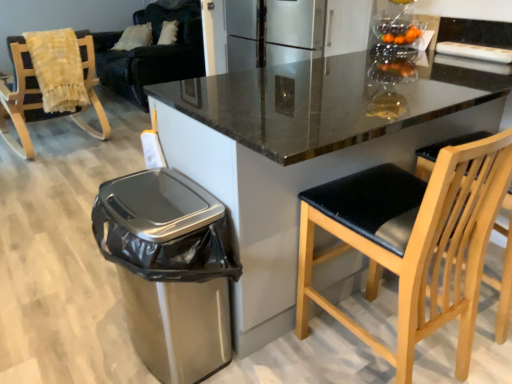
The height and width of the screenshot is (384, 512). Describe the element at coordinates (412, 241) in the screenshot. I see `black leather chair at right, positioned as the first chair in right-to-left order` at that location.

The width and height of the screenshot is (512, 384). What do you see at coordinates (152, 53) in the screenshot?
I see `dark blue fabric couch at upper left` at bounding box center [152, 53].

The width and height of the screenshot is (512, 384). What do you see at coordinates (302, 153) in the screenshot? I see `granite countertop at center` at bounding box center [302, 153].

In order to face wooden rocking chair with fringed blanket at left, the first chair from the back, should I rotate leftwards or rightwards?

A 26.416 degree turn to the left will do.

Consider the image. In order to face satin silver trash can at lower left, should I rotate leftwards or rightwards?

To align with it, rotate left about 12.790°.

Where is `black leather chair at right, positioned as the first chair in right-to-left order`? This screenshot has width=512, height=384. black leather chair at right, positioned as the first chair in right-to-left order is located at coordinates (412, 241).

Do you think satin silver trash can at lower left is within dark blue fabric couch at upper left, or outside of it?

satin silver trash can at lower left is not inside dark blue fabric couch at upper left, it's outside.

Between satin silver trash can at lower left and dark blue fabric couch at upper left, which one has larger width?

With larger width is dark blue fabric couch at upper left.

Considering the relative positions of satin silver trash can at lower left and dark blue fabric couch at upper left in the image provided, is satin silver trash can at lower left to the left or to the right of dark blue fabric couch at upper left?

Clearly, satin silver trash can at lower left is on the right of dark blue fabric couch at upper left in the image.

Considering the positions of point (176, 17) and point (469, 177), is point (176, 17) closer or farther from the camera than point (469, 177)?

Point (176, 17).

From the image's perspective, is dark blue fabric couch at upper left positioned above or below black leather chair at right, the 1th chair when ordered from bottom to top?

dark blue fabric couch at upper left is above black leather chair at right, the 1th chair when ordered from bottom to top.

There is a black leather chair at right, the 1th chair when ordered from bottom to top. Where is `couch above it (from a real-world perspective)`? couch above it (from a real-world perspective) is located at coordinates (152, 53).

Who is more distant, dark blue fabric couch at upper left or black leather chair at right, which appears as the 1th chair when viewed from the front?

dark blue fabric couch at upper left.

Based on the photo, is the depth of granite countertop at center greater than that of wooden rocking chair with fringed blanket at left, the first chair from the back?

No, it is in front of wooden rocking chair with fringed blanket at left, the first chair from the back.

Which is in front, point (403, 157) or point (27, 109)?

Positioned in front is point (403, 157).

Considering the sizes of objects granite countertop at center and wooden rocking chair with fringed blanket at left, the 1th chair positioned from the left, in the image provided, who is smaller, granite countertop at center or wooden rocking chair with fringed blanket at left, the 1th chair positioned from the left,?

With smaller size is wooden rocking chair with fringed blanket at left, the 1th chair positioned from the left.

From a real-world perspective, is wooden rocking chair with fringed blanket at left, which is the 1th chair from top to bottom, positioned over dark blue fabric couch at upper left based on gravity?

No, from a real-world perspective, wooden rocking chair with fringed blanket at left, which is the 1th chair from top to bottom, is not over dark blue fabric couch at upper left

Is the position of wooden rocking chair with fringed blanket at left, the first chair from the back, less distant than that of dark blue fabric couch at upper left?

Yes, it is in front of dark blue fabric couch at upper left.

How much distance is there between wooden rocking chair with fringed blanket at left, which is the 2th chair from bottom to top, and dark blue fabric couch at upper left?

wooden rocking chair with fringed blanket at left, which is the 2th chair from bottom to top, and dark blue fabric couch at upper left are 1.08 meters apart from each other.

Considering the relative sizes of wooden rocking chair with fringed blanket at left, the 1th chair positioned from the left, and dark blue fabric couch at upper left in the image provided, is wooden rocking chair with fringed blanket at left, the 1th chair positioned from the left, bigger than dark blue fabric couch at upper left?

Actually, wooden rocking chair with fringed blanket at left, the 1th chair positioned from the left, might be smaller than dark blue fabric couch at upper left.

What's the angular difference between black leather chair at right, the 2th chair viewed from the top, and granite countertop at center's facing directions?

The angle between the facing direction of black leather chair at right, the 2th chair viewed from the top, and the facing direction of granite countertop at center is 2.89 degrees.

Find the location of a particular element. This screenshot has height=384, width=512. countertop above the black leather chair at right, the 2th chair viewed from the top (from the image's perspective) is located at coordinates tap(302, 153).

Based on the photo, is black leather chair at right, positioned as the first chair in right-to-left order, positioned behind granite countertop at center?

Yes, black leather chair at right, positioned as the first chair in right-to-left order, is further from the camera.

From a real-world perspective, is black leather chair at right, the 2th chair viewed from the top, on granite countertop at center?

Incorrect, from a real-world perspective, black leather chair at right, the 2th chair viewed from the top, is lower than granite countertop at center.

Who is taller, black leather chair at right, the second chair in the left-to-right sequence, or satin silver trash can at lower left?

With more height is black leather chair at right, the second chair in the left-to-right sequence.

Can you confirm if black leather chair at right, positioned as the first chair in right-to-left order, is positioned to the left of satin silver trash can at lower left?

Incorrect, black leather chair at right, positioned as the first chair in right-to-left order, is not on the left side of satin silver trash can at lower left.

From the image's perspective, which object appears higher, black leather chair at right, the 1th chair when ordered from bottom to top, or satin silver trash can at lower left?

From the image's view, black leather chair at right, the 1th chair when ordered from bottom to top, is above.

Is the position of black leather chair at right, the 1th chair when ordered from bottom to top, less distant than that of satin silver trash can at lower left?

Yes, black leather chair at right, the 1th chair when ordered from bottom to top, is in front of satin silver trash can at lower left.

Could you tell me if satin silver trash can at lower left is turned towards black leather chair at right, positioned as the first chair in right-to-left order?

No, satin silver trash can at lower left is not turned towards black leather chair at right, positioned as the first chair in right-to-left order.

Can you tell me how much satin silver trash can at lower left and black leather chair at right, the second chair in the left-to-right sequence, differ in facing direction?

There is a 92.9-degree angle between the facing directions of satin silver trash can at lower left and black leather chair at right, the second chair in the left-to-right sequence.

Is there a large distance between satin silver trash can at lower left and black leather chair at right, arranged as the second chair when viewed from the back?

satin silver trash can at lower left is actually quite close to black leather chair at right, arranged as the second chair when viewed from the back.

Considering the sizes of objects satin silver trash can at lower left and black leather chair at right, which appears as the 1th chair when viewed from the front, in the image provided, who is shorter, satin silver trash can at lower left or black leather chair at right, which appears as the 1th chair when viewed from the front,?

Standing shorter between the two is satin silver trash can at lower left.

This screenshot has height=384, width=512. In order to click on couch on the left side of satin silver trash can at lower left in this screenshot , I will do `click(152, 53)`.

I want to click on chair on the right of dark blue fabric couch at upper left, so click(x=412, y=241).

Which object lies nearer to the anchor point dark blue fabric couch at upper left, wooden rocking chair with fringed blanket at left, the 2th chair positioned from the front, or black leather chair at right, the 2th chair viewed from the top?

Among the two, wooden rocking chair with fringed blanket at left, the 2th chair positioned from the front, is located nearer to dark blue fabric couch at upper left.

Estimate the real-world distances between objects in this image. Which object is closer to satin silver trash can at lower left, granite countertop at center or dark blue fabric couch at upper left?

Based on the image, granite countertop at center appears to be nearer to satin silver trash can at lower left.

Estimate the real-world distances between objects in this image. Which object is further from dark blue fabric couch at upper left, wooden rocking chair with fringed blanket at left, the first chair from the back, or granite countertop at center?

granite countertop at center.

Which object lies further to the anchor point black leather chair at right, which appears as the 1th chair when viewed from the front, dark blue fabric couch at upper left or satin silver trash can at lower left?

The object further to black leather chair at right, which appears as the 1th chair when viewed from the front, is dark blue fabric couch at upper left.

Looking at the image, which one is located closer to black leather chair at right, which appears as the 1th chair when viewed from the front, dark blue fabric couch at upper left or granite countertop at center?

granite countertop at center.

Looking at the image, which one is located further to granite countertop at center, black leather chair at right, which appears as the 1th chair when viewed from the front, or dark blue fabric couch at upper left?

dark blue fabric couch at upper left is further to granite countertop at center.

Estimate the real-world distances between objects in this image. Which object is closer to wooden rocking chair with fringed blanket at left, the 1th chair positioned from the left, black leather chair at right, the second chair in the left-to-right sequence, or satin silver trash can at lower left?

satin silver trash can at lower left lies closer to wooden rocking chair with fringed blanket at left, the 1th chair positioned from the left, than the other object.

From the image, which object appears to be nearer to dark blue fabric couch at upper left, granite countertop at center or satin silver trash can at lower left?

granite countertop at center is closer to dark blue fabric couch at upper left.

You are a GUI agent. You are given a task and a screenshot of the screen. Output one action in this format:
    pyautogui.click(x=<x>, y=<y>)
    Task: Click on the countertop located between wooden rocking chair with fringed blanket at left, which is the 1th chair from top to bottom, and black leather chair at right, the 2th chair viewed from the top, in the left-right direction
    
    Given the screenshot: What is the action you would take?
    pyautogui.click(x=302, y=153)

This screenshot has height=384, width=512. What are the coordinates of `waste container between wooden rocking chair with fringed blanket at left, placed as the second chair when sorted from right to left, and granite countertop at center` in the screenshot? It's located at (170, 269).

Find the location of a particular element. The height and width of the screenshot is (384, 512). waste container located between wooden rocking chair with fringed blanket at left, the 2th chair positioned from the front, and black leather chair at right, positioned as the first chair in right-to-left order, in the left-right direction is located at coordinates (170, 269).

You are a GUI agent. You are given a task and a screenshot of the screen. Output one action in this format:
    pyautogui.click(x=<x>, y=<y>)
    Task: Click on the waste container located between black leather chair at right, the second chair in the left-to-right sequence, and dark blue fabric couch at upper left in the depth direction
    
    Given the screenshot: What is the action you would take?
    pyautogui.click(x=170, y=269)